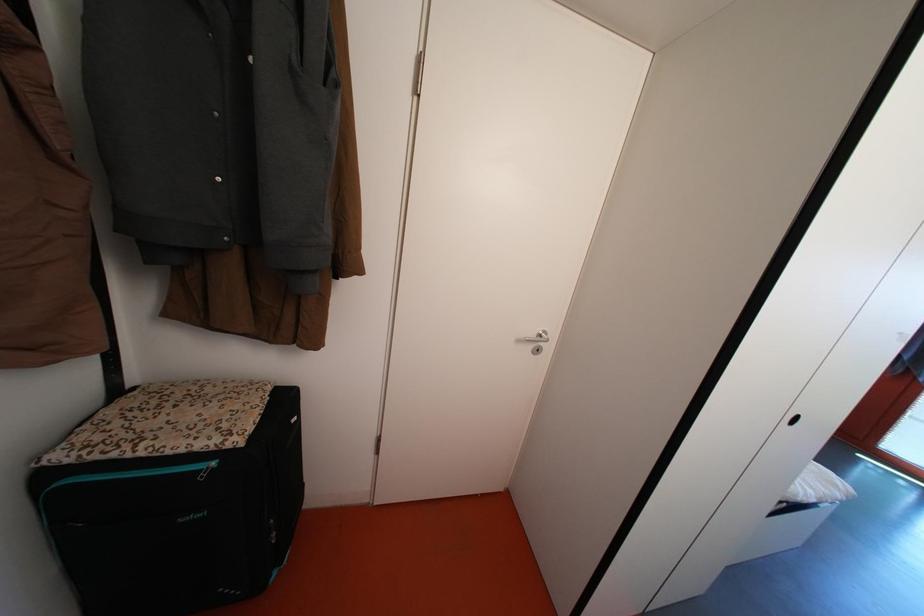
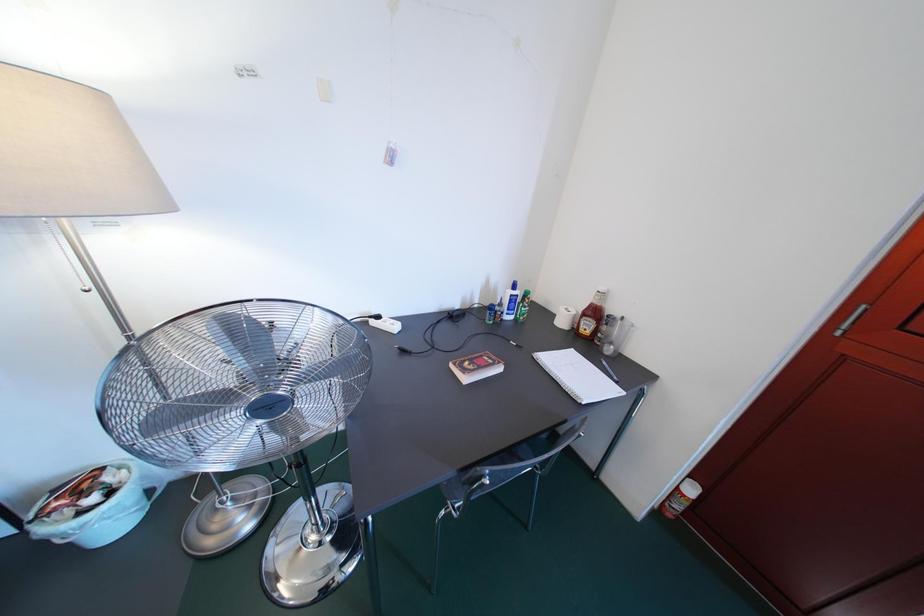
In a continuous first-person perspective shot, in which direction is the camera moving?

The cameraman moved toward right, forward.